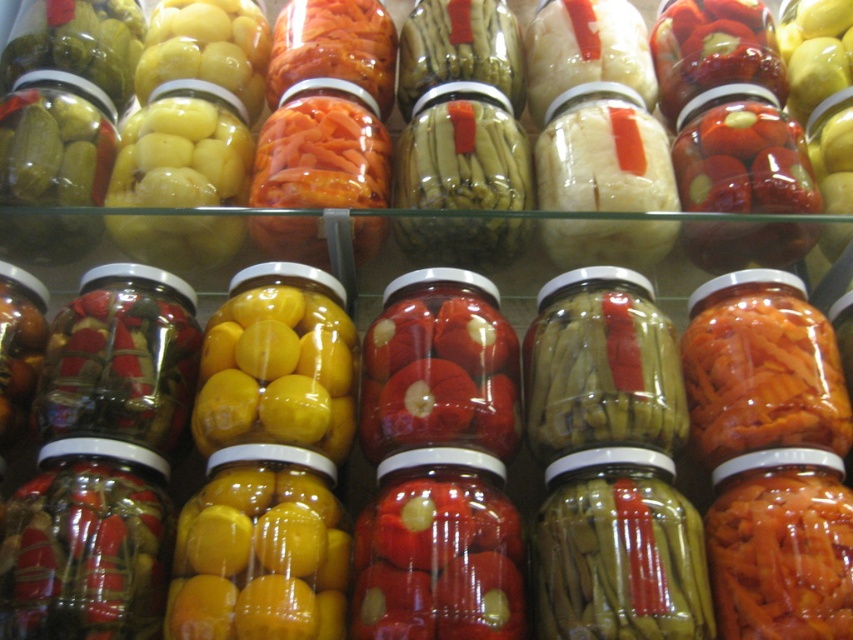
What do you see at coordinates (618, 550) in the screenshot? This screenshot has height=640, width=853. I see `green matte pickles at center` at bounding box center [618, 550].

Does green matte pickles at center have a smaller size compared to translucent glass jar at left?

Yes, green matte pickles at center is smaller than translucent glass jar at left.

Between point (637, 609) and point (149, 333), which one is positioned behind?

Positioned behind is point (149, 333).

You are a GUI agent. You are given a task and a screenshot of the screen. Output one action in this format:
    pyautogui.click(x=<x>, y=<y>)
    Task: Click on the green matte pickles at center
    
    Given the screenshot: What is the action you would take?
    pyautogui.click(x=618, y=550)